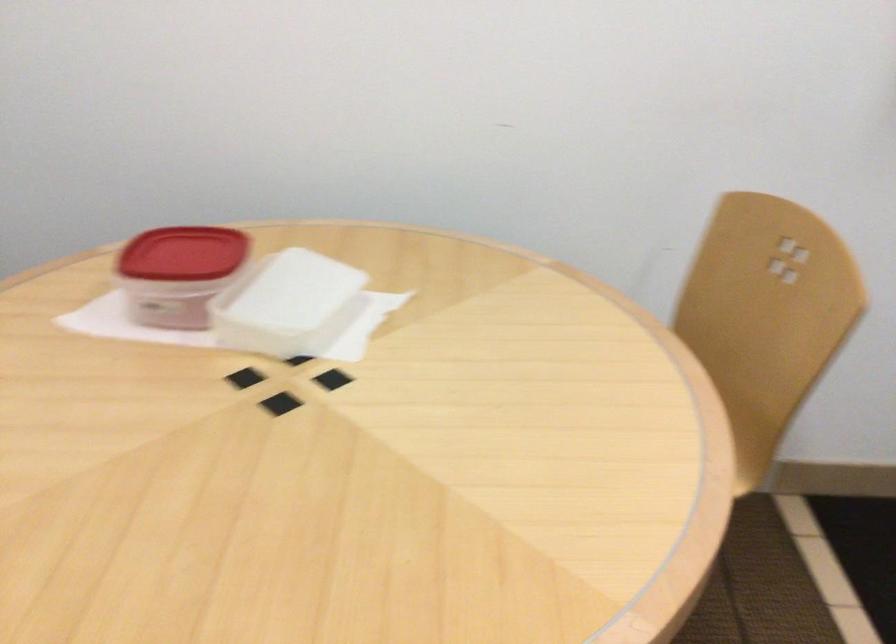
Find the location of `red container lid`. red container lid is located at coordinates (183, 252).